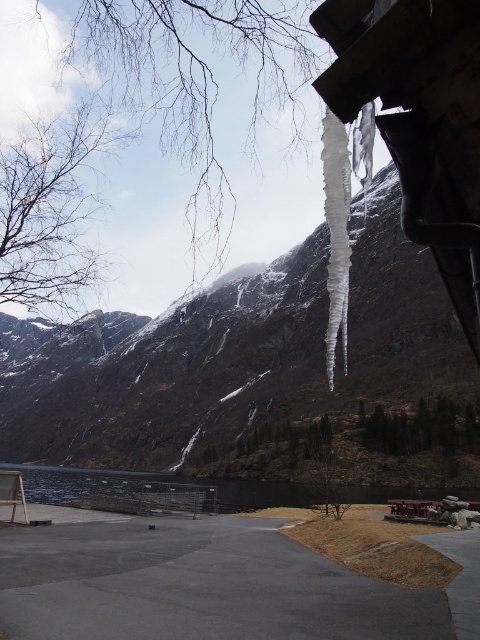
You are standing on a balcony and want to take a photo of both the snowy rock mountain at upper center and the dark reflective water at center. Can you frame both in your camera without moving your position?

The snowy rock mountain at upper center is above the dark reflective water at center, so you can frame both in your camera without moving your position.

You are standing on the balcony and want to know which object in the scene occupies a wider area in the image. Which one is wider between the snowy rock mountain at upper center and the dark reflective water at center?

The snowy rock mountain at upper center is wider than the dark reflective water at center according to the description.

You are standing on the balcony and want to take a photo of both the snowy rock mountain at upper center and the dark reflective water at center. Which object should you focus on first to ensure both are in sharp focus?

You should focus on the snowy rock mountain at upper center first since it is closer to the viewer than the dark reflective water at center, so adjusting focus from near to far will help both be in focus.